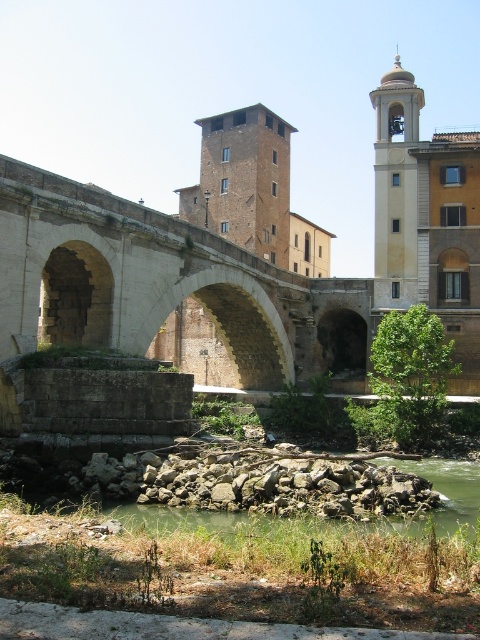
Is brown brick tower at center thinner than light beige stone bell tower at upper right?

In fact, brown brick tower at center might be wider than light beige stone bell tower at upper right.

The height and width of the screenshot is (640, 480). What do you see at coordinates (243, 180) in the screenshot?
I see `brown brick tower at center` at bounding box center [243, 180].

This screenshot has height=640, width=480. I want to click on brown brick tower at center, so click(243, 180).

Who is more forward, (x=83, y=188) or (x=254, y=109)?

Point (x=83, y=188) is in front.

Which of these two, stone arch bridge at center or brown brick tower at center, stands shorter?

stone arch bridge at center

Does point (23, 348) come behind point (203, 164)?

That is False.

Find the location of a particular element. Image resolution: width=480 pixels, height=640 pixels. stone arch bridge at center is located at coordinates (164, 284).

Between point (160, 214) and point (382, 161), which one is positioned behind?

The point (382, 161) is more distant.

Is stone arch bridge at center bigger than light beige stone bell tower at upper right?

Indeed, stone arch bridge at center has a larger size compared to light beige stone bell tower at upper right.

Who is more forward, (169, 259) or (428, 250)?

Positioned in front is point (169, 259).

Find the location of `stone arch bridge at center`. stone arch bridge at center is located at coordinates (164, 284).